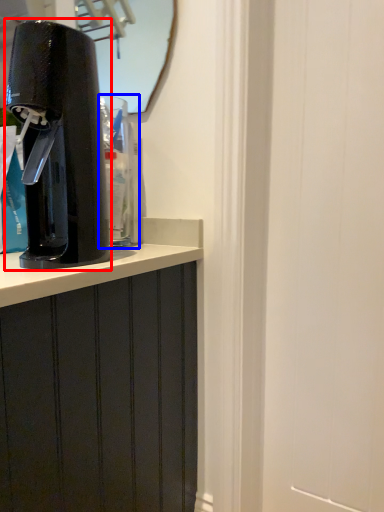
Question: Which of the following is the closest to the observer, home appliance (highlighted by a red box) or water cooler (highlighted by a blue box)?

Choices:
 (A) home appliance
 (B) water cooler

Answer: (A)